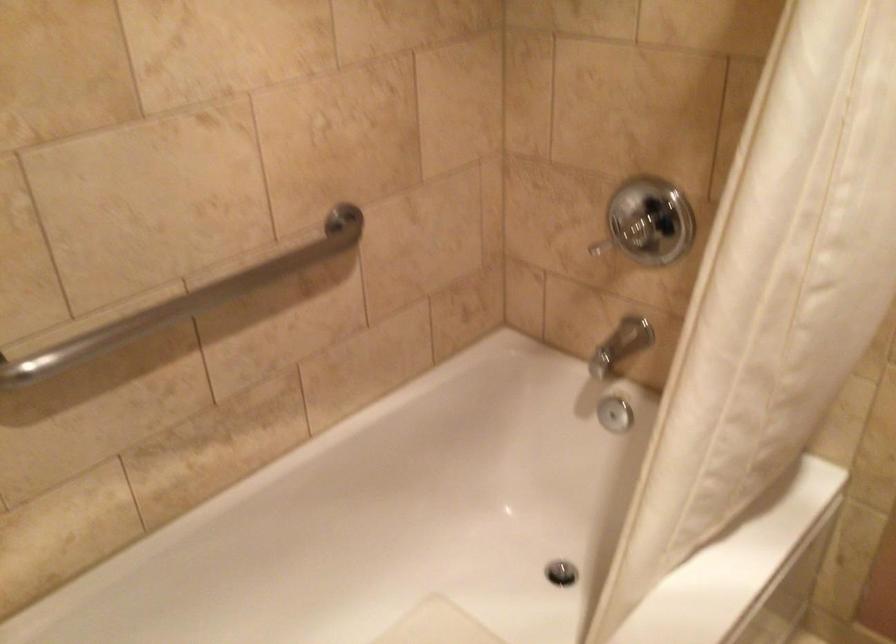
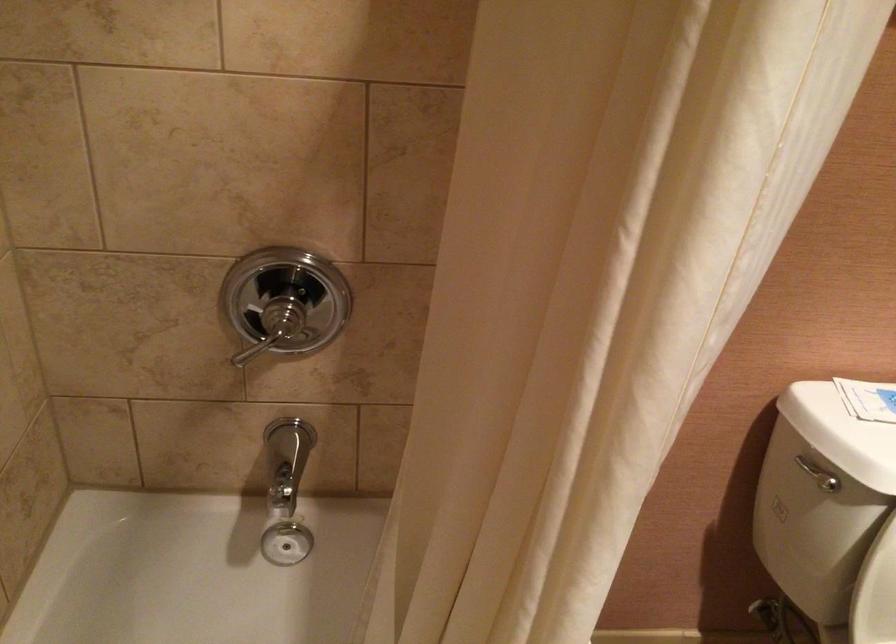
Question: The camera is either moving clockwise (left) or counter-clockwise (right) around the object. The first image is from the beginning of the video and the second image is from the end. Is the camera moving left or right when shooting the video?

Choices:
 (A) Left
 (B) Right

Answer: (A)